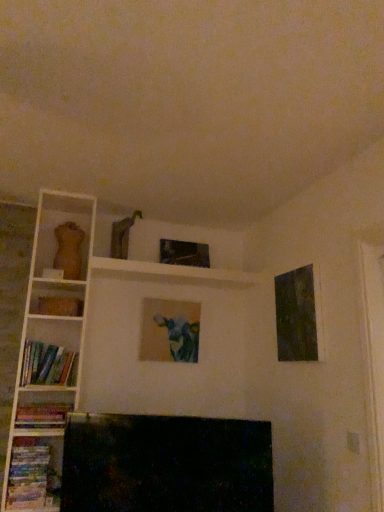
Question: Can you confirm if dark textured canvas at upper right, the first picture frame when ordered from front to back, is thinner than matte canvas painting at center, which appears as the 2th picture frame when viewed from the front?

Choices:
 (A) no
 (B) yes

Answer: (B)

Question: Does dark textured canvas at upper right, the first picture frame when ordered from front to back, have a smaller size compared to matte canvas painting at center, which appears as the 1th picture frame when viewed from the left?

Choices:
 (A) yes
 (B) no

Answer: (A)

Question: Does dark textured canvas at upper right, the first picture frame viewed from the right, appear on the right side of matte canvas painting at center, which appears as the 1th picture frame when viewed from the left?

Choices:
 (A) yes
 (B) no

Answer: (A)

Question: Is dark textured canvas at upper right, the first picture frame when ordered from front to back, positioned in front of matte canvas painting at center, the 3th picture frame in the right-to-left sequence?

Choices:
 (A) yes
 (B) no

Answer: (A)

Question: Is dark textured canvas at upper right, acting as the third picture frame starting from the left, wider than matte canvas painting at center, which appears as the 1th picture frame when viewed from the left?

Choices:
 (A) yes
 (B) no

Answer: (B)

Question: Considering the positions of matte canvas painting at center, the 2th picture frame from the back, and dark textured canvas at upper right, the first picture frame when ordered from front to back, in the image, is matte canvas painting at center, the 2th picture frame from the back, wider or thinner than dark textured canvas at upper right, the first picture frame when ordered from front to back,?

Choices:
 (A) thin
 (B) wide

Answer: (B)

Question: Considering the positions of matte canvas painting at center, the 2th picture frame from the back, and dark textured canvas at upper right, which is the 3th picture frame in back-to-front order, in the image, is matte canvas painting at center, the 2th picture frame from the back, bigger or smaller than dark textured canvas at upper right, which is the 3th picture frame in back-to-front order,?

Choices:
 (A) small
 (B) big

Answer: (B)

Question: From a real-world perspective, is matte canvas painting at center, which appears as the 1th picture frame when viewed from the left, above or below dark textured canvas at upper right, which is the 3th picture frame in back-to-front order?

Choices:
 (A) below
 (B) above

Answer: (A)

Question: Does point (142, 342) appear closer or farther from the camera than point (291, 285)?

Choices:
 (A) farther
 (B) closer

Answer: (A)

Question: Visually, is hardcover books at left, the 1th book from the top, positioned to the left or to the right of dark textured canvas at upper right, acting as the third picture frame starting from the left?

Choices:
 (A) right
 (B) left

Answer: (B)

Question: Which is correct: hardcover books at left, the 1th book from the top, is inside dark textured canvas at upper right, acting as the third picture frame starting from the left, or outside of it?

Choices:
 (A) inside
 (B) outside

Answer: (B)

Question: Considering the positions of hardcover books at left, the 3th book positioned from the bottom, and dark textured canvas at upper right, acting as the third picture frame starting from the left, in the image, is hardcover books at left, the 3th book positioned from the bottom, wider or thinner than dark textured canvas at upper right, acting as the third picture frame starting from the left,?

Choices:
 (A) wide
 (B) thin

Answer: (A)

Question: From a real-world perspective, is hardcover books at left, the 1th book from the top, positioned above or below dark textured canvas at upper right, the first picture frame when ordered from front to back?

Choices:
 (A) below
 (B) above

Answer: (A)

Question: From the image's perspective, relative to hardcover books at left, positioned as the second book in top-to-bottom order, is dark textured canvas at upper right, the first picture frame viewed from the right, above or below?

Choices:
 (A) above
 (B) below

Answer: (A)

Question: Is dark textured canvas at upper right, the first picture frame viewed from the right, bigger or smaller than hardcover books at left, the second book when ordered from bottom to top?

Choices:
 (A) small
 (B) big

Answer: (B)